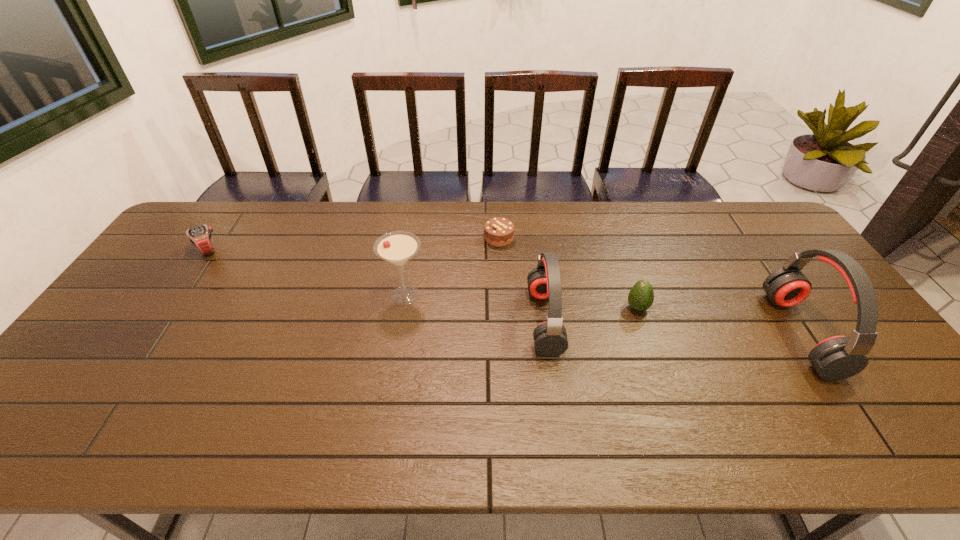
Image resolution: width=960 pixels, height=540 pixels. What are the coordinates of `the left earphone` in the screenshot? It's located at (550, 338).

Where is `the third object from right to left`? This screenshot has width=960, height=540. the third object from right to left is located at coordinates (550, 338).

Identify the location of the tallest object. This screenshot has height=540, width=960. (836, 358).

Find the location of a particular element. The height and width of the screenshot is (540, 960). the right earphone is located at coordinates (836, 358).

Locate an element on the screen. The height and width of the screenshot is (540, 960). chocolate cake is located at coordinates (498, 232).

Locate an element on the screen. watch is located at coordinates (200, 236).

Find the location of a particular element. the third shortest object is located at coordinates (641, 296).

Where is `avocado`? The height and width of the screenshot is (540, 960). avocado is located at coordinates (641, 296).

I want to click on the second object from left to right, so click(398, 247).

Identify the location of blank space located on the ear cups of the third object from right to left. (398, 321).